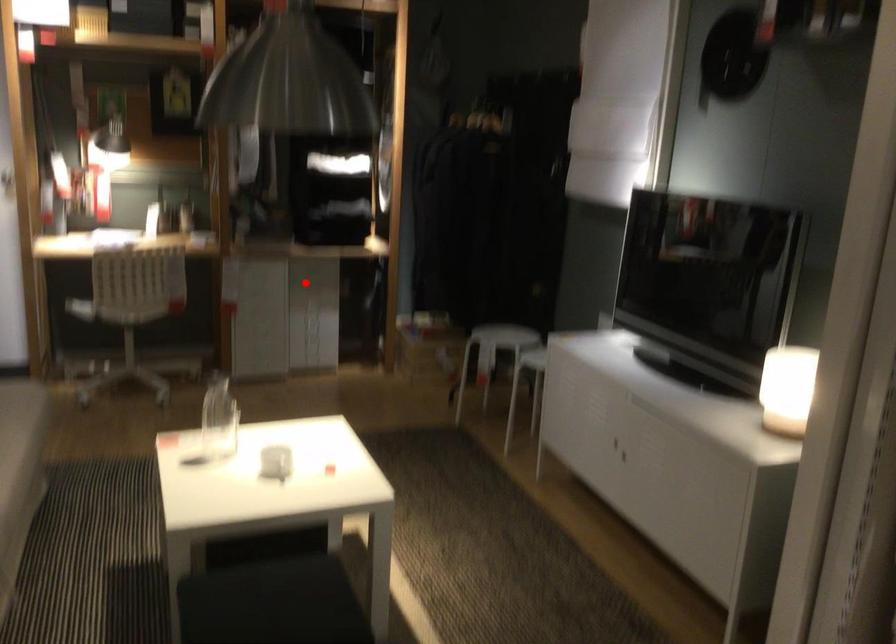
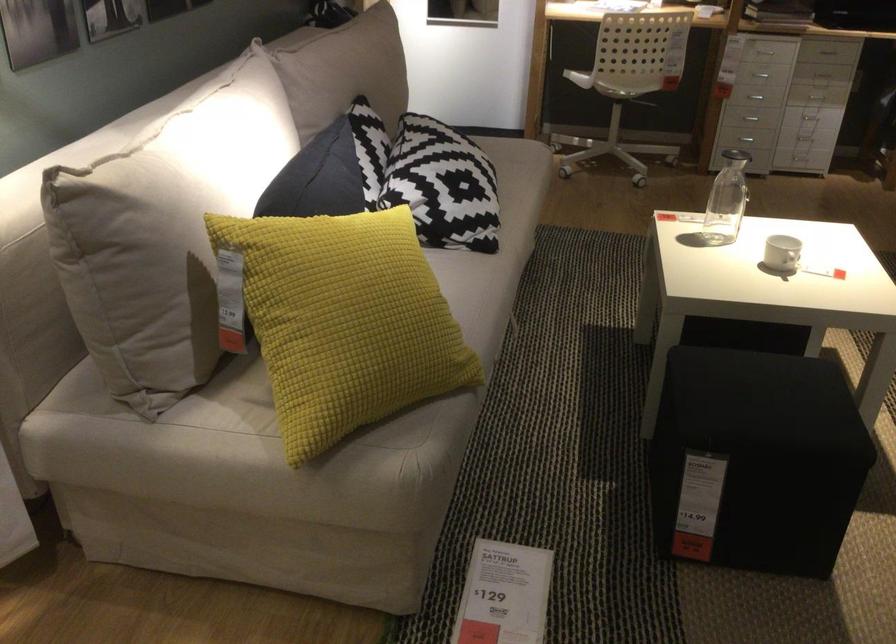
Question: A red point is marked in image1. In image2, is the corresponding 3D point closer to the camera or farther? Reply with the corresponding letter.

Choices:
 (A) The corresponding 3D point is closer.
 (B) The corresponding 3D point is farther.

Answer: (A)